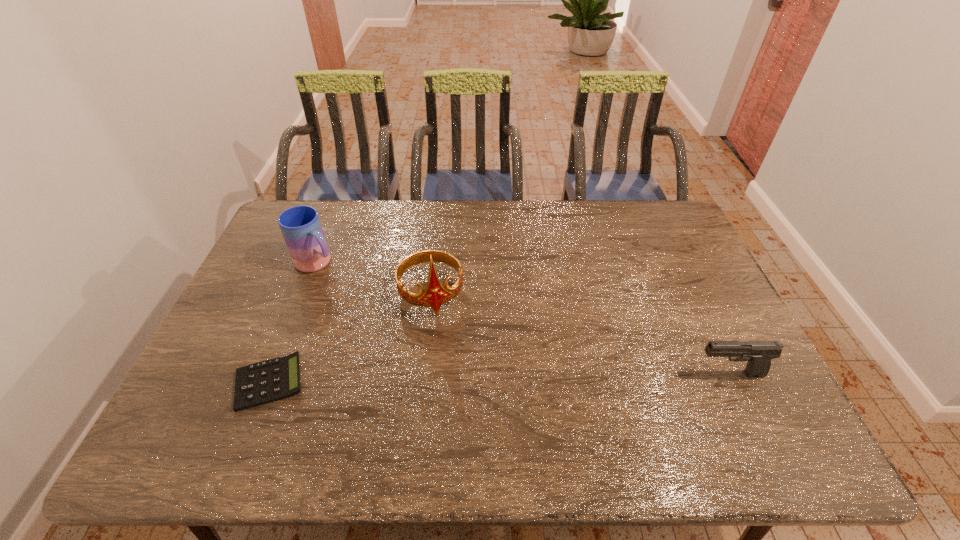
Where is `free space located on the front-facing side of the third object from left to right`? Image resolution: width=960 pixels, height=540 pixels. free space located on the front-facing side of the third object from left to right is located at coordinates (448, 366).

At what (x,y) coordinates should I click in order to perform the action: click on free region located on the front-facing side of the third object from left to right. Please return your answer as a coordinate pair (x, y). Image resolution: width=960 pixels, height=540 pixels. Looking at the image, I should click on (444, 350).

At what (x,y) coordinates should I click in order to perform the action: click on vacant space located on the front-facing side of the third object from left to right. Please return your answer as a coordinate pair (x, y). Looking at the image, I should click on (444, 348).

What are the coordinates of `blank area located on the side of the second tallest object with the handle` in the screenshot? It's located at (416, 336).

You are a GUI agent. You are given a task and a screenshot of the screen. Output one action in this format:
    pyautogui.click(x=<x>, y=<y>)
    Task: Click on the vacant space located 0.100m on the side of the second tallest object with the handle
    Image resolution: width=960 pixels, height=540 pixels.
    Given the screenshot: What is the action you would take?
    pyautogui.click(x=350, y=287)

Locate an element on the screen. Image resolution: width=960 pixels, height=540 pixels. free region located on the side of the second tallest object with the handle is located at coordinates (370, 301).

Where is `object that is at the near edge`? The height and width of the screenshot is (540, 960). object that is at the near edge is located at coordinates (272, 380).

You are a GUI agent. You are given a task and a screenshot of the screen. Output one action in this format:
    pyautogui.click(x=<x>, y=<y>)
    Task: Click on the calculator that is at the left edge
    
    Given the screenshot: What is the action you would take?
    pyautogui.click(x=272, y=380)

Where is `mug that is at the left edge`? The image size is (960, 540). mug that is at the left edge is located at coordinates (301, 228).

Where is `object located in the right edge section of the desktop`? This screenshot has width=960, height=540. object located in the right edge section of the desktop is located at coordinates (759, 354).